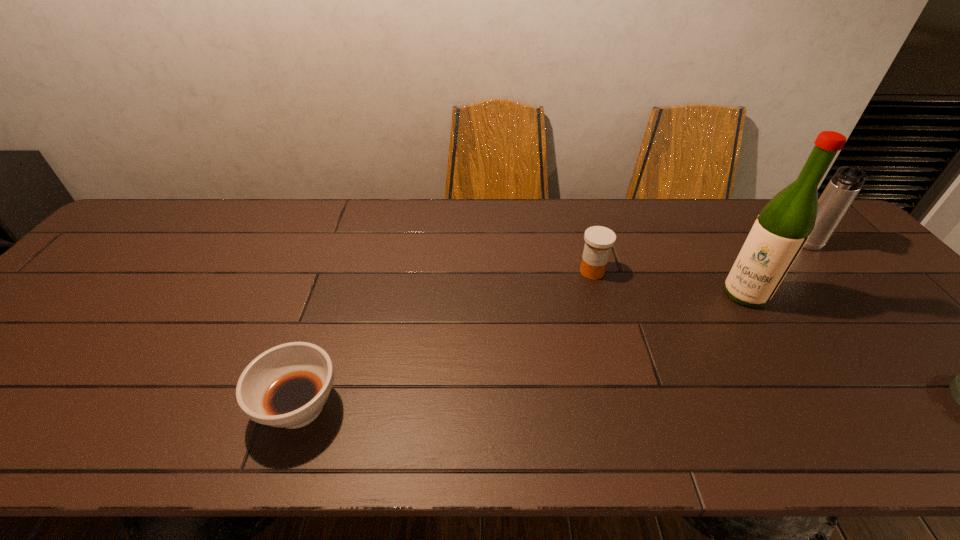
Where is `vacant space on the desktop that is between the leftmost object and the ashtray and is positioned on the label of the third shortest object`? The height and width of the screenshot is (540, 960). vacant space on the desktop that is between the leftmost object and the ashtray and is positioned on the label of the third shortest object is located at coordinates (667, 407).

Locate an element on the screen. The width and height of the screenshot is (960, 540). vacant space on the desktop that is between the soup bowl and the shortest object and is positioned on the handle side of the farthest object is located at coordinates (684, 407).

Identify the location of free spot on the desktop that is between the second shortest object and the shortest object and is positioned on the label of the third object from left to right. The image size is (960, 540). (644, 407).